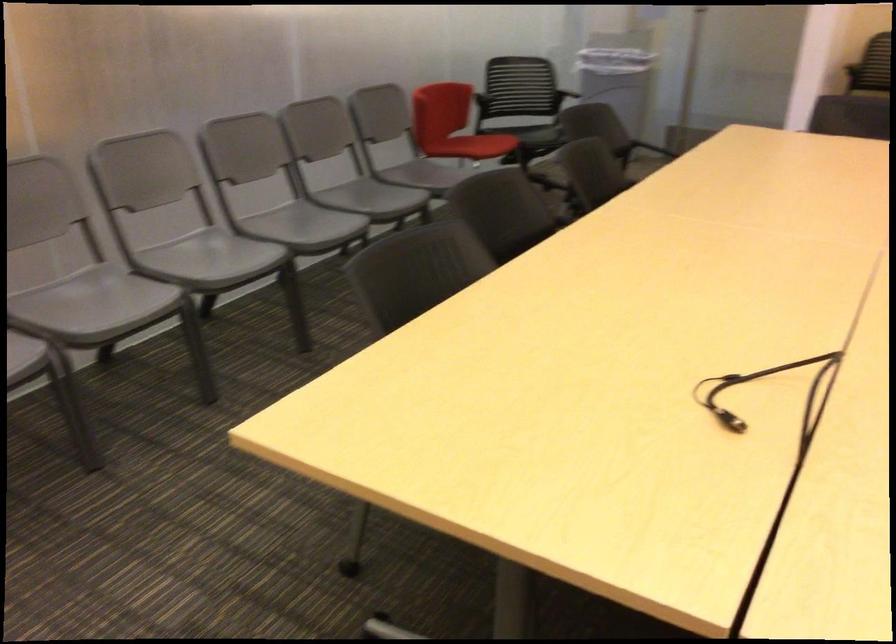
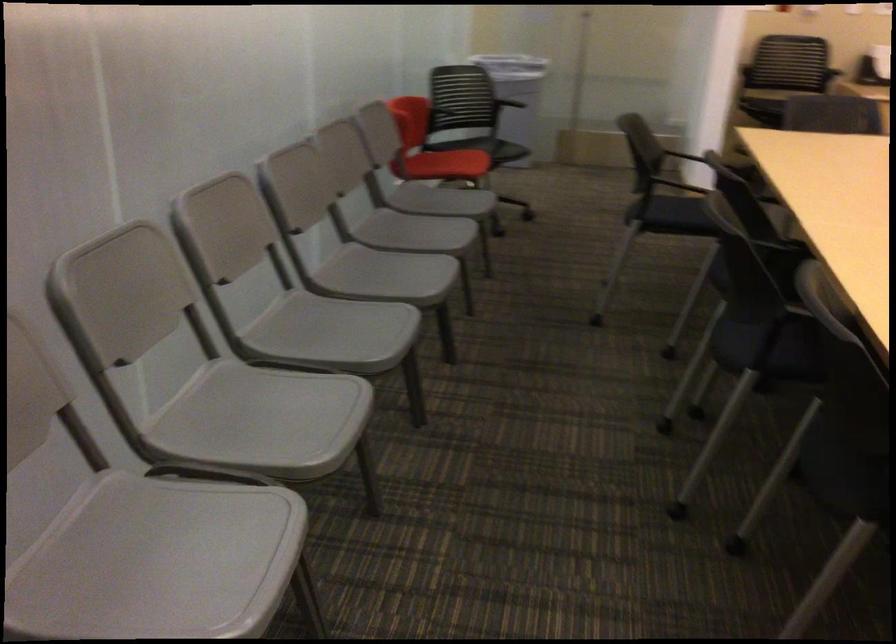
Where in the second image is the point corresponding to pixel 224 258 from the first image?

(332, 332)